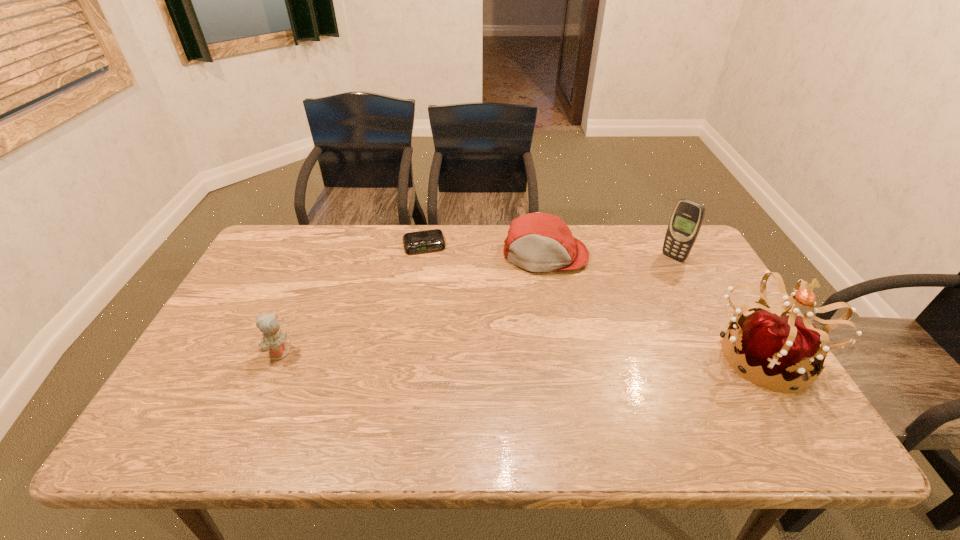
Find the location of a particular element. This screenshot has width=960, height=540. blank area located on the screen of the fourth shortest object is located at coordinates (648, 280).

You are a GUI agent. You are given a task and a screenshot of the screen. Output one action in this format:
    pyautogui.click(x=<x>, y=<y>)
    Task: Click on the vacant space located 0.330m on the screen of the fourth shortest object
    Image resolution: width=960 pixels, height=540 pixels.
    Given the screenshot: What is the action you would take?
    pyautogui.click(x=610, y=315)

Locate an element on the screen. The height and width of the screenshot is (540, 960). free space located on the display of the alarm clock is located at coordinates (445, 332).

Find the location of a particular element. The image size is (960, 540). free space located on the display of the alarm clock is located at coordinates (443, 319).

What are the coordinates of `vacant region located on the display of the alarm clock` in the screenshot? It's located at pos(438,296).

This screenshot has height=540, width=960. Find the location of `vacant space located 0.300m on the front-facing side of the cap`. vacant space located 0.300m on the front-facing side of the cap is located at coordinates (535, 351).

Identify the location of vacant space positioned 0.370m on the front-facing side of the cap. This screenshot has width=960, height=540. point(533,373).

Locate an element on the screen. This screenshot has width=960, height=540. vacant space situated on the front-facing side of the cap is located at coordinates (538, 320).

At what (x,y) coordinates should I click in order to perform the action: click on cellular telephone located at the far edge. Please return your answer as a coordinate pair (x, y). The height and width of the screenshot is (540, 960). Looking at the image, I should click on (688, 215).

Identify the location of alarm clock present at the far edge. The height and width of the screenshot is (540, 960). (432, 240).